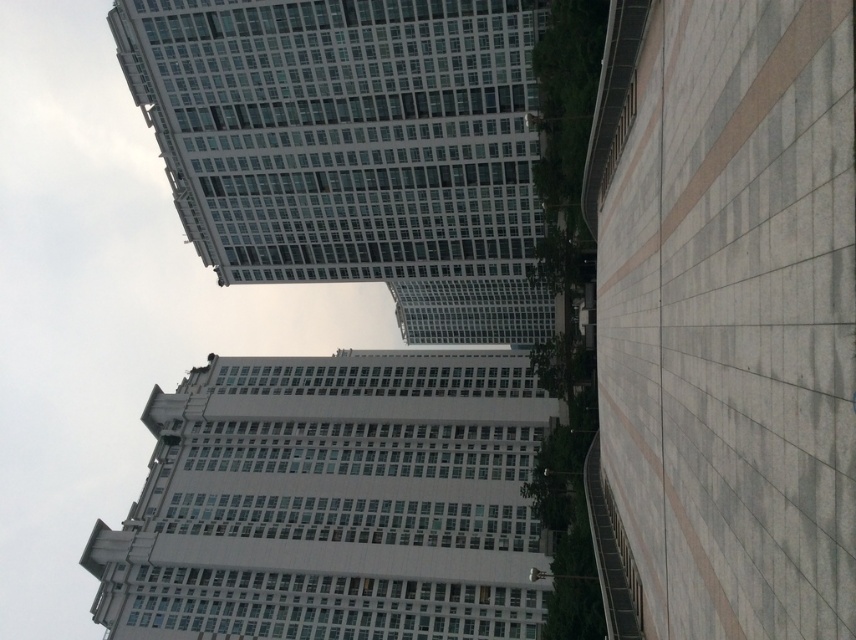
Who is more distant from viewer, (631,417) or (434,419)?

Point (434,419)

Is point (682, 227) closer to camera compared to point (245, 582)?

Yes.

Is point (746, 211) more distant than point (314, 552)?

No, it is not.

Locate an element on the screen. white smooth sidewalk at right is located at coordinates 728,312.

Does white smooth building at center have a lesser width compared to white glass building at upper center?

Yes, white smooth building at center is thinner than white glass building at upper center.

Is white smooth building at center shorter than white glass building at upper center?

Correct, white smooth building at center is not as tall as white glass building at upper center.

What are the coordinates of `white smooth building at center` in the screenshot? It's located at (334, 500).

Which of these two, white smooth sidewalk at right or white glass building at upper center, stands shorter?

With less height is white smooth sidewalk at right.

Who is more forward, (x=851, y=45) or (x=500, y=164)?

Positioned in front is point (x=851, y=45).

Where is `white smooth sidewalk at right`? The height and width of the screenshot is (640, 856). white smooth sidewalk at right is located at coordinates (728, 312).

I want to click on white smooth sidewalk at right, so click(x=728, y=312).